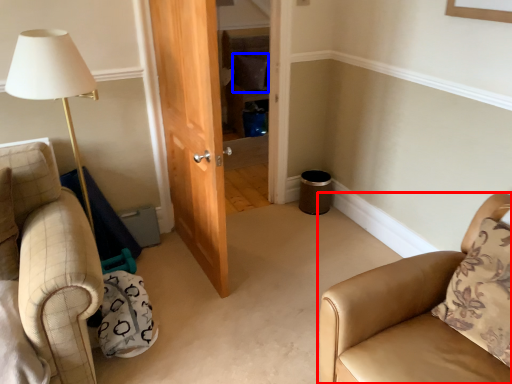
Question: Which object appears farthest to the camera in this image, chair (highlighted by a red box) or pillow (highlighted by a blue box)?

Choices:
 (A) chair
 (B) pillow

Answer: (B)